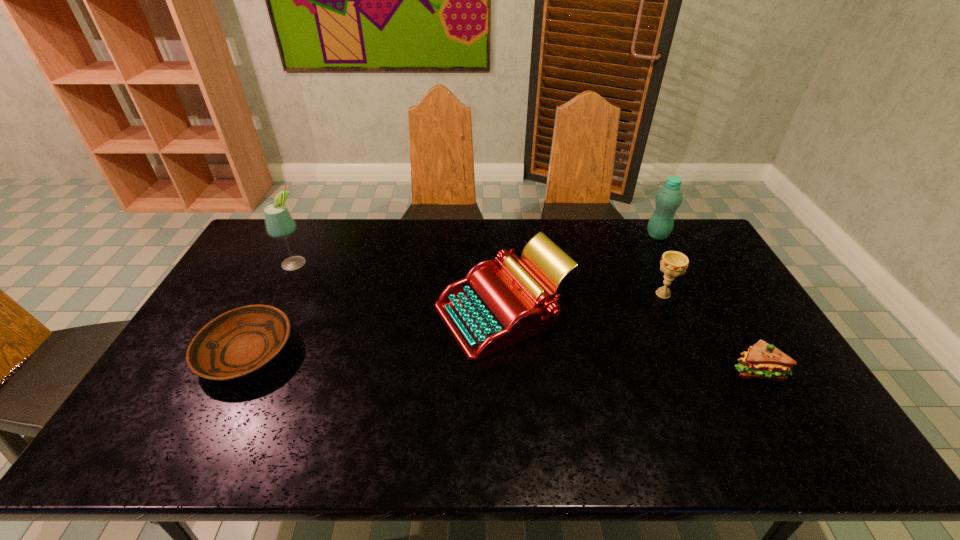
Image resolution: width=960 pixels, height=540 pixels. I want to click on the tallest object, so click(279, 223).

Where is `the second farthest object`? This screenshot has height=540, width=960. the second farthest object is located at coordinates (279, 223).

At what (x,y) coordinates should I click in order to perform the action: click on the fifth shortest object. Please return your answer as a coordinate pair (x, y). This screenshot has width=960, height=540. Looking at the image, I should click on (668, 199).

Find the location of `water bottle`. water bottle is located at coordinates (668, 199).

Find the location of a particular element. typewriter is located at coordinates (492, 308).

Find the location of a particular element. the fourth shortest object is located at coordinates (492, 308).

Locate an element on the screen. the fourth tallest object is located at coordinates (673, 263).

At what (x,y) coordinates should I click in order to perform the action: click on sandwich. Please return your answer as a coordinate pair (x, y). Looking at the image, I should click on (762, 360).

Find the location of a particular element. This screenshot has width=960, height=540. plate is located at coordinates (237, 343).

What are the coordinates of `vacant point located on the front of the alcohol` in the screenshot? It's located at (284, 284).